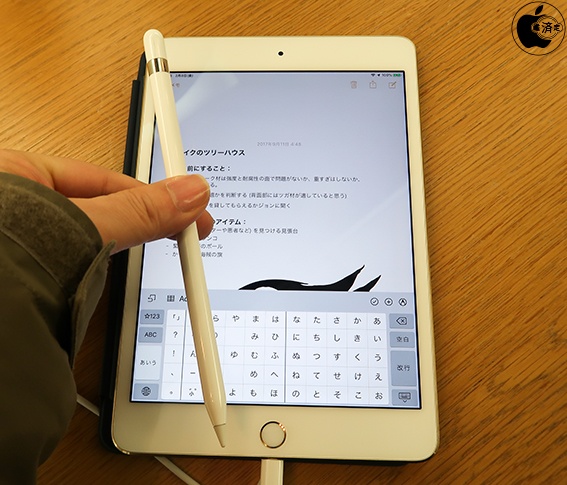
What are the coordinates of `table` in the screenshot? It's located at pos(480,198).